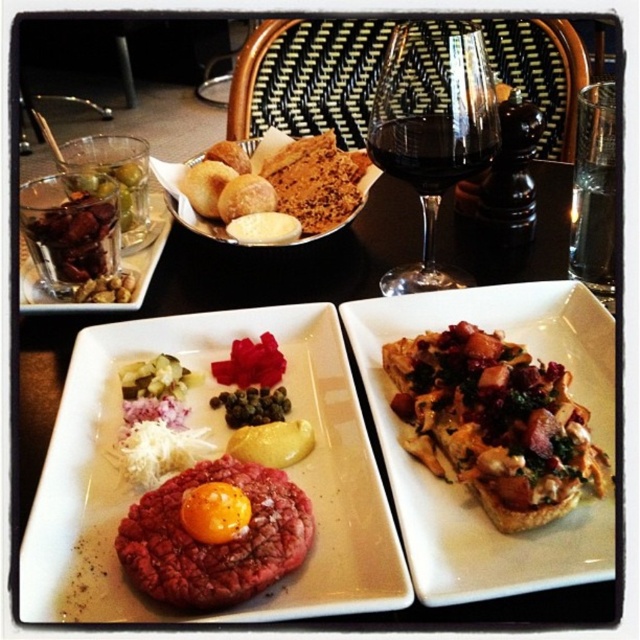
Measure the distance between golden brown bread at center and translucent glass with nuts at upper left.

golden brown bread at center is 3.39 inches away from translucent glass with nuts at upper left.

Looking at this image, does golden brown bread at center have a greater height compared to translucent glass with nuts at upper left?

Correct, golden brown bread at center is much taller as translucent glass with nuts at upper left.

At what (x,y) coordinates should I click in order to perform the action: click on golden brown bread at center. Please return your answer as a coordinate pair (x, y). This screenshot has height=640, width=640. Looking at the image, I should click on (221, 225).

Locate an element on the screen. The image size is (640, 640). raw red meat at center is located at coordinates (220, 449).

Measure the distance between raw red meat at center and camera.

raw red meat at center and camera are 9.37 inches apart.

This screenshot has width=640, height=640. In order to click on raw red meat at center in this screenshot , I will do `click(220, 449)`.

Is point (282, 275) less distant than point (268, 518)?

No, it is not.

Can you confirm if matte glass at upper center is wider than raw red beef at center?

Indeed, matte glass at upper center has a greater width compared to raw red beef at center.

Is point (56, 372) positioned after point (232, 577)?

Yes, point (56, 372) is behind point (232, 577).

Locate an element on the screen. The image size is (640, 640). matte glass at upper center is located at coordinates (291, 262).